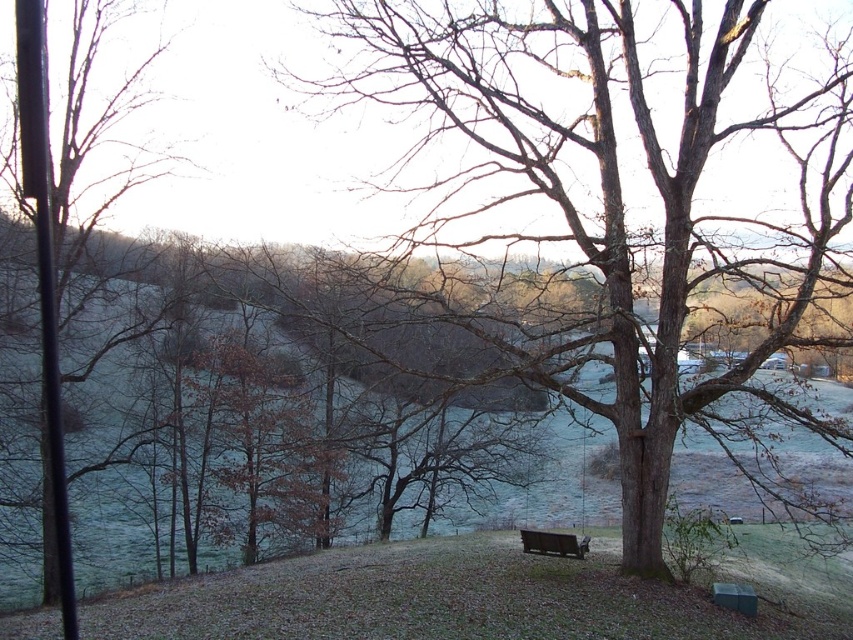
Which is behind, point (630, 312) or point (546, 545)?

The point (546, 545) is more distant.

Does brown rough textured tree at center have a lesser width compared to brown wooden bench at lower center?

Indeed, brown rough textured tree at center has a lesser width compared to brown wooden bench at lower center.

Does point (730, 10) lie in front of point (555, 544)?

Yes, point (730, 10) is in front of point (555, 544).

Image resolution: width=853 pixels, height=640 pixels. I want to click on brown rough textured tree at center, so click(x=599, y=186).

Is brown rough textured tree at center further to the viewer compared to bare branches at left?

Yes, it is.

Who is more distant from viewer, (682,152) or (22,147)?

The point (682,152) is more distant.

This screenshot has height=640, width=853. Find the location of `brown rough textured tree at center`. brown rough textured tree at center is located at coordinates (599, 186).

Does point (44, 541) lie in front of point (550, 540)?

That is False.

What do you see at coordinates (96, 132) in the screenshot?
I see `bare branches at left` at bounding box center [96, 132].

What are the coordinates of `bare branches at left` in the screenshot? It's located at (96, 132).